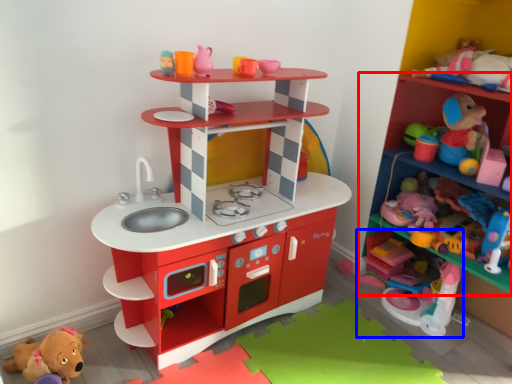
Question: Which object is further to the camera taking this photo, shelf (highlighted by a red box) or toy (highlighted by a blue box)?

Choices:
 (A) shelf
 (B) toy

Answer: (B)